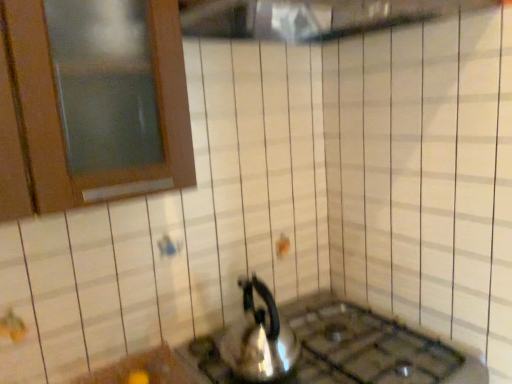
Question: Based on their positions, is satin silver gas stove at lower center located to the left or right of sleek metallic kettle at center?

Choices:
 (A) left
 (B) right

Answer: (B)

Question: Is point (318, 357) closer or farther from the camera than point (266, 355)?

Choices:
 (A) farther
 (B) closer

Answer: (A)

Question: From their relative heights in the image, would you say satin silver gas stove at lower center is taller or shorter than sleek metallic kettle at center?

Choices:
 (A) tall
 (B) short

Answer: (B)

Question: Considering the positions of point (259, 281) and point (387, 347), is point (259, 281) closer or farther from the camera than point (387, 347)?

Choices:
 (A) closer
 (B) farther

Answer: (B)

Question: Relative to satin silver gas stove at lower center, is sleek metallic kettle at center in front or behind?

Choices:
 (A) front
 (B) behind

Answer: (B)

Question: Based on their positions, is sleek metallic kettle at center located to the left or right of satin silver gas stove at lower center?

Choices:
 (A) left
 (B) right

Answer: (A)

Question: From a real-world perspective, is sleek metallic kettle at center positioned above or below satin silver gas stove at lower center?

Choices:
 (A) below
 (B) above

Answer: (B)